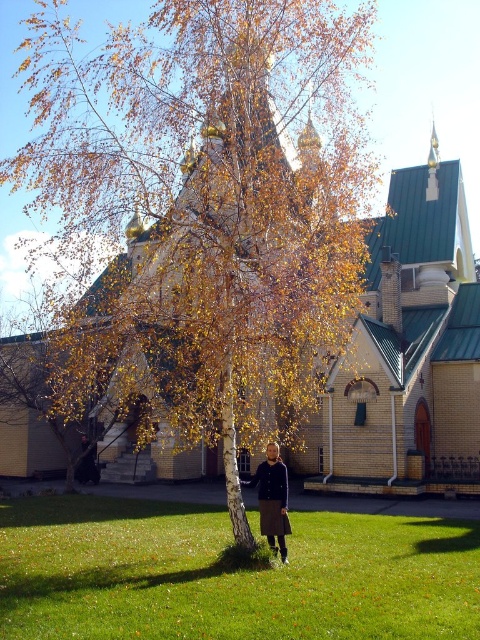
You are standing at the point marked as point (x=228, y=576) in the image. What is the terrain like at this location?

The point (x=228, y=576) corresponds to green grass at lower center, so the terrain at this location is grassy.

You are standing at point A at point (475, 472) and want to walk to the church. There is a birch tree in the way. Can you walk around the tree to reach the church?

The distance between you and the church is 227.98 feet, so you can walk around the birch tree to reach the church.